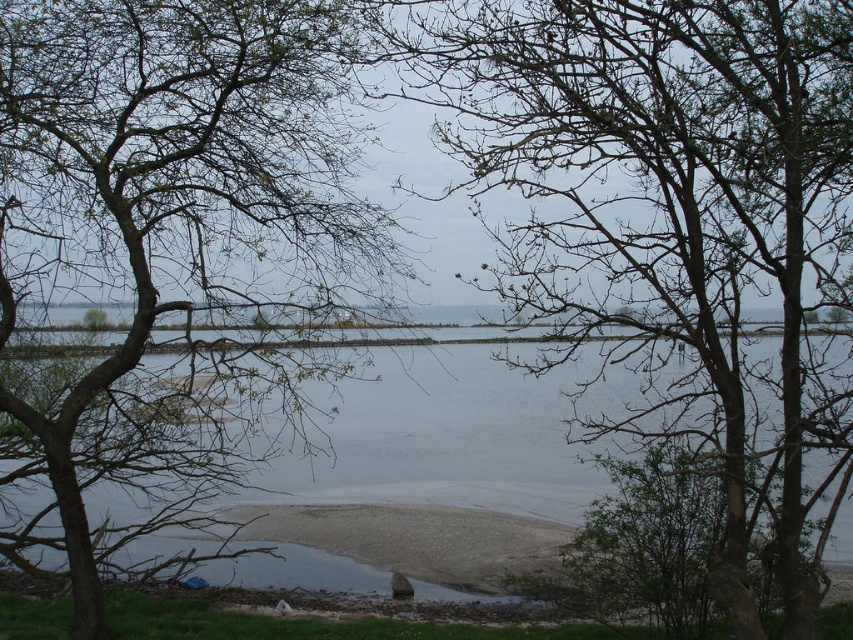
You are standing in the middle of the lakeside path and notice two sets of bare branches in the scene. Which set of bare branches, the bare branches at center or the bare branches at left, is positioned lower in the image?

The bare branches at center is positioned lower in the image than the bare branches at left.

You are an artist planning to paint the lakeside scene. You want to ensure that the width of the bare branches at center and clear water at center in your painting matches the actual scene. Based on the description, which object should you depict as wider in your artwork?

The bare branches at center might be wider than clear water at center, so you should depict the bare branches at center as wider in your painting to match the actual scene.